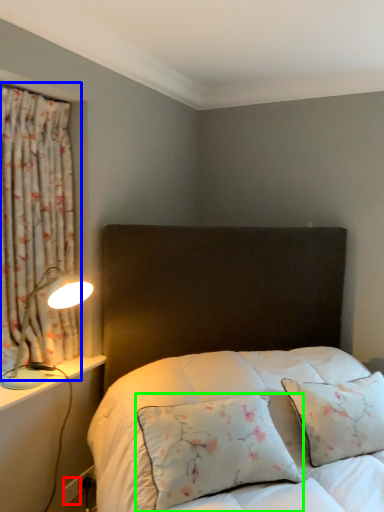
Question: Based on their relative distances, which object is farther from electric outlet (highlighted by a red box)? Choose from curtain (highlighted by a blue box) and pillow (highlighted by a green box).

Choices:
 (A) curtain
 (B) pillow

Answer: (A)